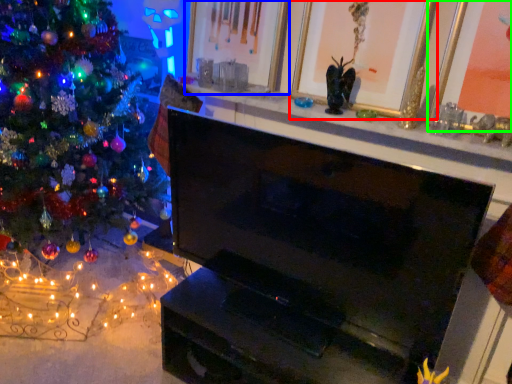
Question: Considering the real-world distances, which object is closest to picture frame (highlighted by a red box)? picture frame (highlighted by a blue box) or picture frame (highlighted by a green box).

Choices:
 (A) picture frame
 (B) picture frame

Answer: (A)